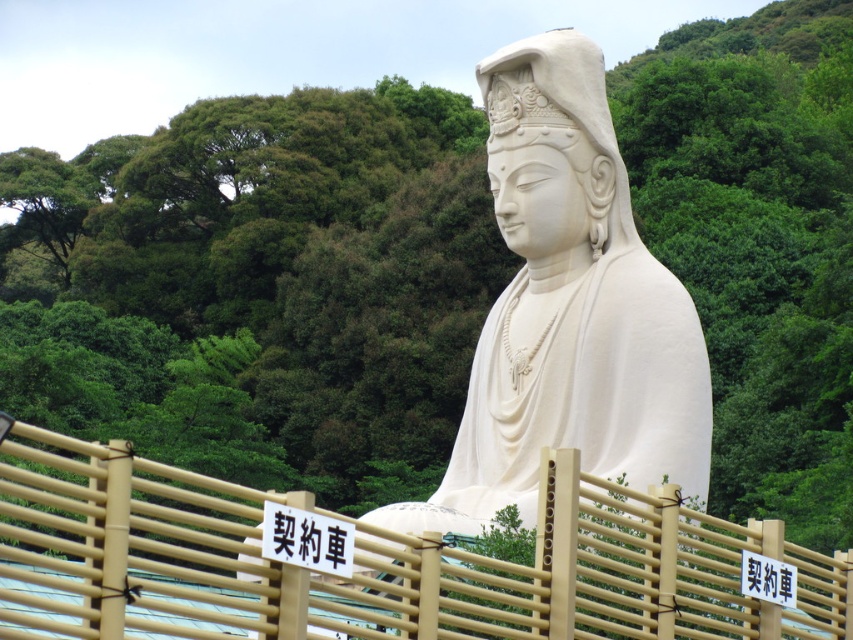
Who is higher up, white marble statue at center or black paper sign at center?

white marble statue at center is above.

Does white marble statue at center have a greater height compared to black paper sign at center?

Correct, white marble statue at center is much taller as black paper sign at center.

Between point (618, 381) and point (309, 561), which one is positioned in front?

Point (309, 561) is in front.

Identify the location of white marble statue at center. coord(567,308).

Can you confirm if bamboo fence at center is smaller than black paper sign at center?

Actually, bamboo fence at center might be larger than black paper sign at center.

Find the location of `bamboo fence at center`. bamboo fence at center is located at coordinates (375, 561).

Is bamboo fence at center below white marble statue at center?

Indeed, bamboo fence at center is positioned under white marble statue at center.

Locate an element on the screen. This screenshot has width=853, height=640. bamboo fence at center is located at coordinates (375, 561).